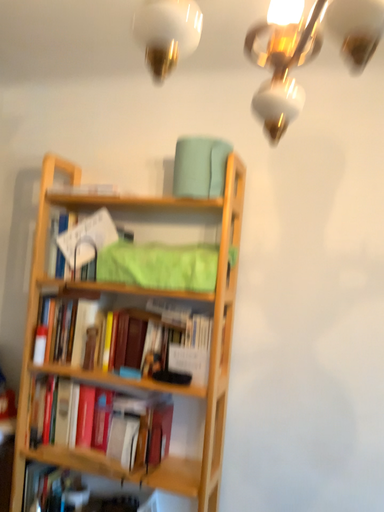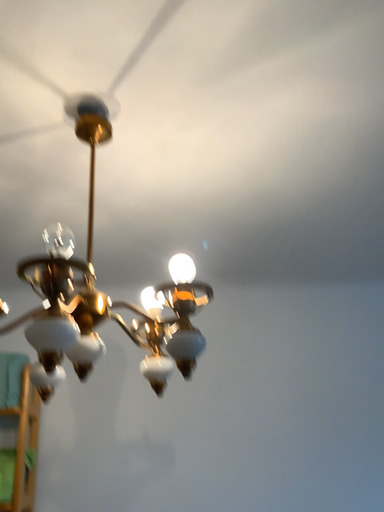
Question: Which way did the camera rotate in the video?

Choices:
 (A) rotated right
 (B) rotated left

Answer: (A)